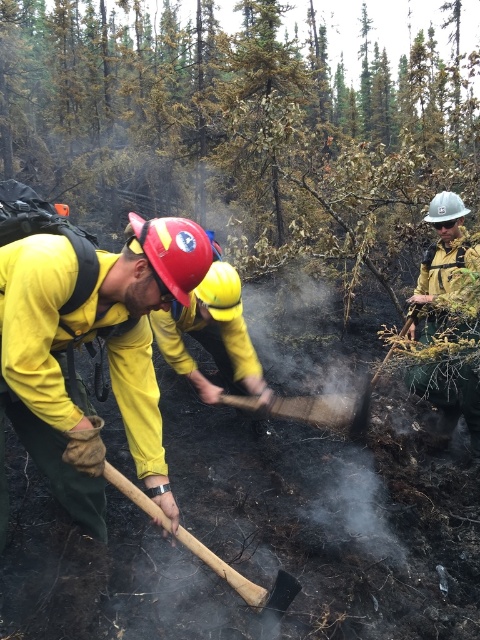
Question: Among these objects, which one is farthest from the camera?

Choices:
 (A) matte yellow jacket at left
 (B) wooden shovel at center

Answer: (B)

Question: Where is matte yellow jacket at left located in relation to wooden shovel at center in the image?

Choices:
 (A) left
 (B) right

Answer: (A)

Question: Does matte yellow jacket at left have a greater width compared to wooden shovel at center?

Choices:
 (A) no
 (B) yes

Answer: (B)

Question: In this image, where is matte yellow jacket at left located relative to wooden shovel at center?

Choices:
 (A) below
 (B) above

Answer: (B)

Question: Which point appears closest to the camera in this image?

Choices:
 (A) (144, 317)
 (B) (283, 404)

Answer: (A)